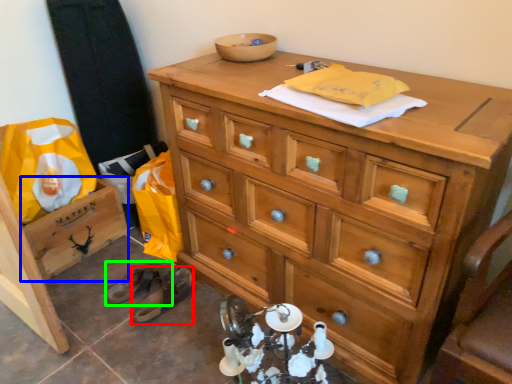
Question: Based on their relative distances, which object is farther from shoe (highlighted by a red box)? Choose from cabinetry (highlighted by a blue box) and shoe (highlighted by a green box).

Choices:
 (A) cabinetry
 (B) shoe

Answer: (A)